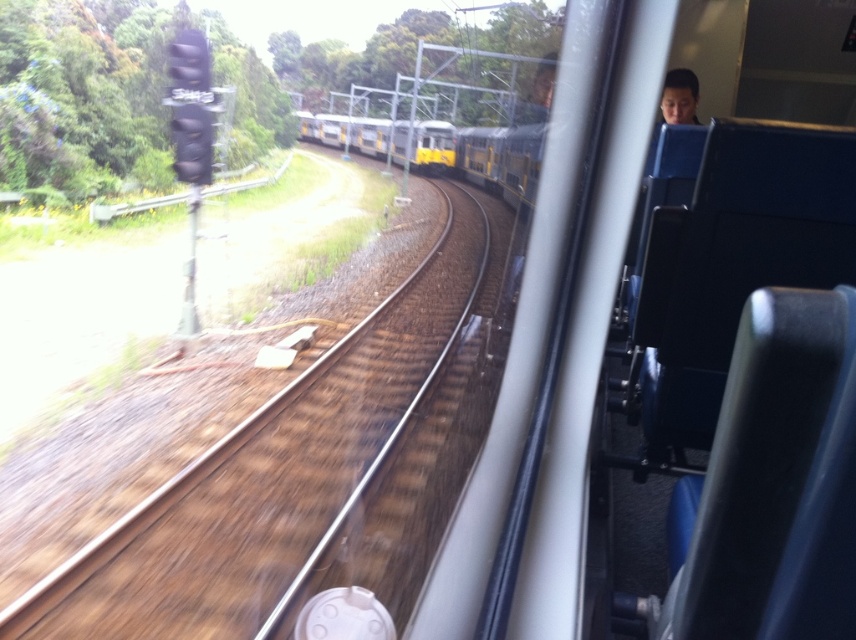
Does yellow matte train at center appear under smooth skin face at upper right?

No.

Measure the distance between point (510,163) and camera.

26.81 meters

Locate an element on the screen. This screenshot has width=856, height=640. yellow matte train at center is located at coordinates (501, 160).

Is point (177, 504) positioned in front of point (675, 68)?

Yes, it is in front of point (675, 68).

Does brown gravel train track at left appear under smooth skin face at upper right?

Yes.

Does point (16, 600) come farther from viewer compared to point (670, 81)?

That is False.

This screenshot has height=640, width=856. I want to click on brown gravel train track at left, so click(x=265, y=476).

What do you see at coordinates (501, 160) in the screenshot? This screenshot has height=640, width=856. I see `yellow matte train at center` at bounding box center [501, 160].

At what (x,y) coordinates should I click in order to perform the action: click on yellow matte train at center. Please return your answer as a coordinate pair (x, y). Looking at the image, I should click on (501, 160).